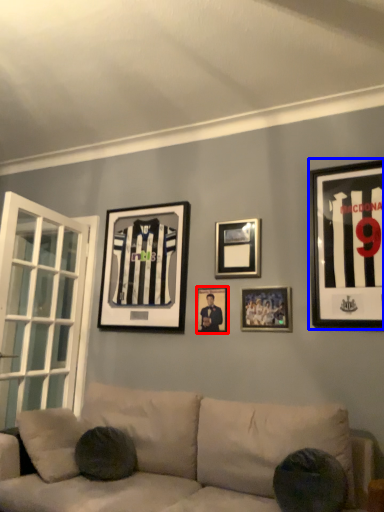
Question: Which of the following is the closest to the observer, picture frame (highlighted by a red box) or picture frame (highlighted by a blue box)?

Choices:
 (A) picture frame
 (B) picture frame

Answer: (B)